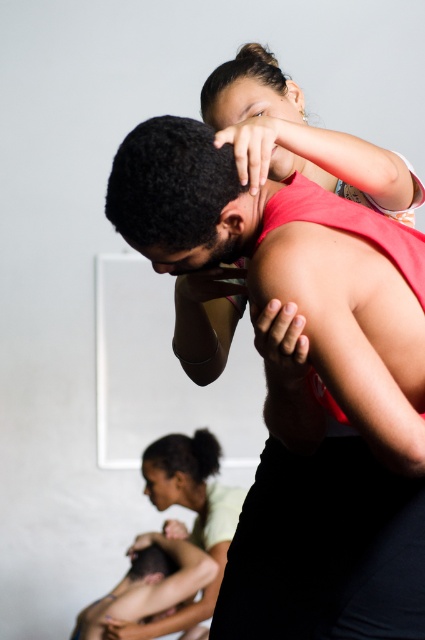
Between matte red tank top at center and matte pink tank top at upper center, which one has less height?

matte pink tank top at upper center is shorter.

Which is in front, point (350, 392) or point (340, 177)?

Positioned in front is point (350, 392).

Identify the location of matte red tank top at center. The image size is (425, 640). click(319, 374).